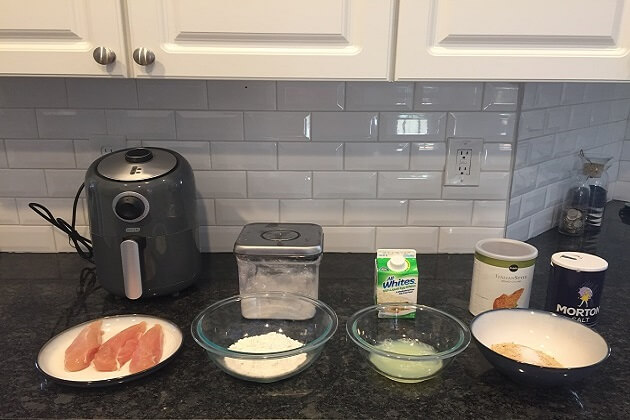
I want to click on jars, so click(x=581, y=214).